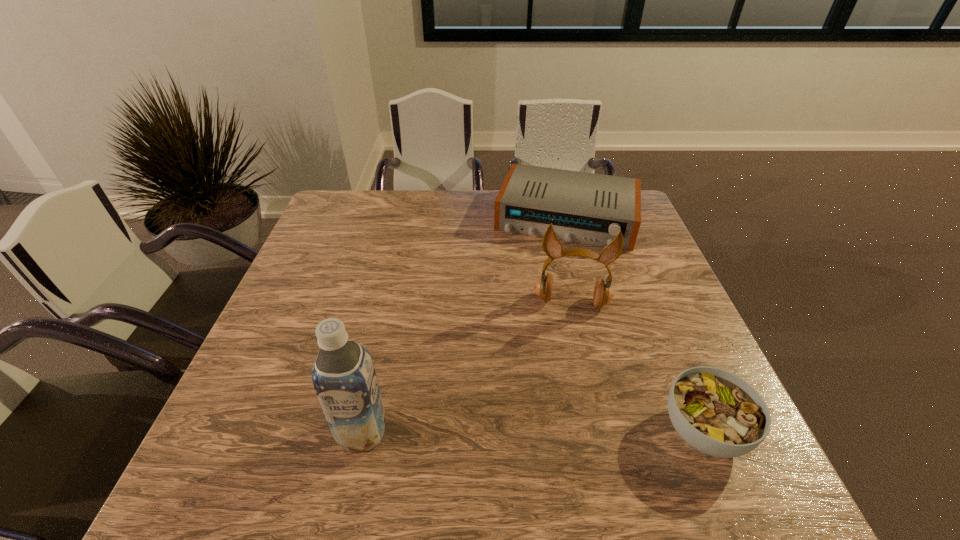
Locate an element on the screen. Image resolution: width=960 pixels, height=540 pixels. free spot on the desktop that is between the tallest object and the soup bowl and is positioned on the front-facing side of the earphone is located at coordinates (569, 431).

Where is `vacant spot on the desktop that is between the leftmost object and the soup bowl and is positioned on the control panel of the radio receiver`? vacant spot on the desktop that is between the leftmost object and the soup bowl and is positioned on the control panel of the radio receiver is located at coordinates (518, 431).